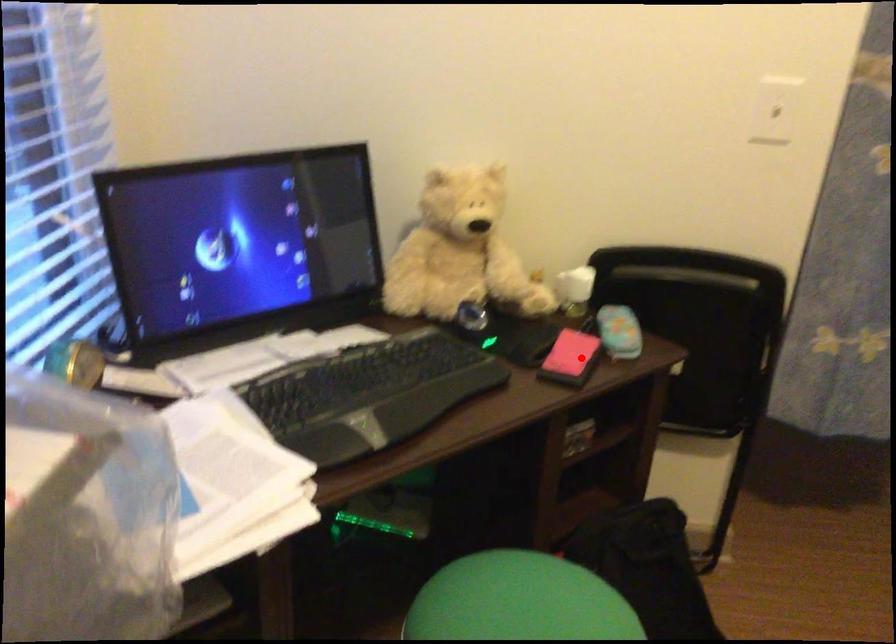
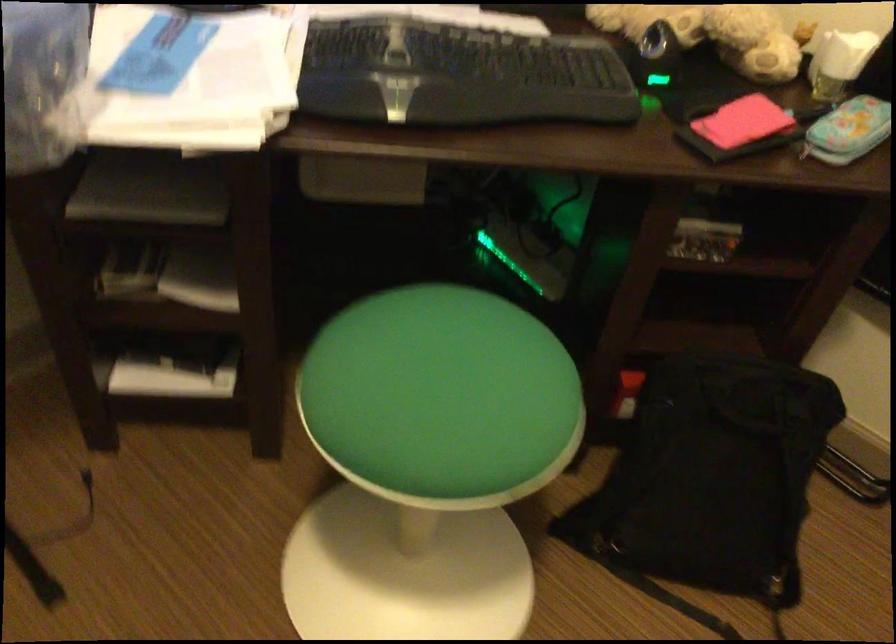
Locate, in the second image, the point that corresponds to the highlighted location in the first image.

(739, 128)